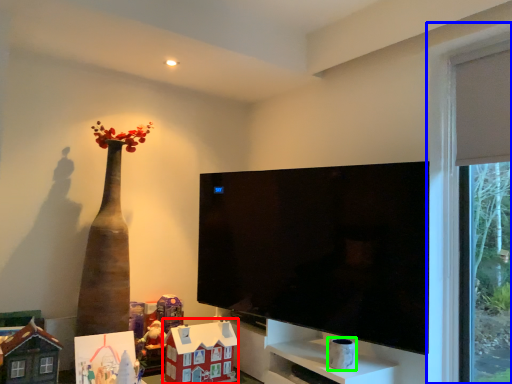
Question: Considering the real-world distances, which object is farthest from toy (highlighted by a red box)? window (highlighted by a blue box) or toy (highlighted by a green box)?

Choices:
 (A) window
 (B) toy

Answer: (A)